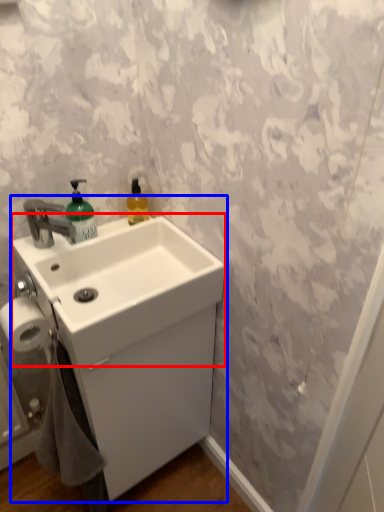
Question: Which object is closer to the camera taking this photo, counter top (highlighted by a red box) or sink (highlighted by a blue box)?

Choices:
 (A) counter top
 (B) sink

Answer: (A)